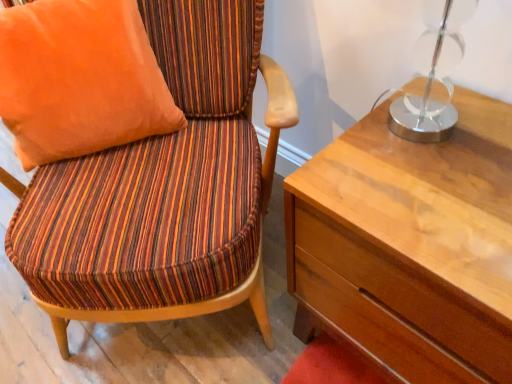
Question: Is striped fabric chair at left bigger than orange fabric pillow at upper left?

Choices:
 (A) yes
 (B) no

Answer: (A)

Question: From a real-world perspective, is striped fabric chair at left below orange fabric pillow at upper left?

Choices:
 (A) yes
 (B) no

Answer: (A)

Question: From a real-world perspective, is striped fabric chair at left on top of orange fabric pillow at upper left?

Choices:
 (A) no
 (B) yes

Answer: (A)

Question: Is striped fabric chair at left turned away from orange fabric pillow at upper left?

Choices:
 (A) no
 (B) yes

Answer: (B)

Question: From the image's perspective, is striped fabric chair at left beneath orange fabric pillow at upper left?

Choices:
 (A) no
 (B) yes

Answer: (B)

Question: From the image's perspective, would you say striped fabric chair at left is positioned over orange fabric pillow at upper left?

Choices:
 (A) no
 (B) yes

Answer: (A)

Question: Is orange fabric pillow at upper left far from striped fabric chair at left?

Choices:
 (A) no
 (B) yes

Answer: (A)

Question: Considering the relative sizes of orange fabric pillow at upper left and striped fabric chair at left in the image provided, is orange fabric pillow at upper left wider than striped fabric chair at left?

Choices:
 (A) yes
 (B) no

Answer: (B)

Question: Is orange fabric pillow at upper left further to camera compared to striped fabric chair at left?

Choices:
 (A) yes
 (B) no

Answer: (A)

Question: Considering the relative sizes of orange fabric pillow at upper left and striped fabric chair at left in the image provided, is orange fabric pillow at upper left thinner than striped fabric chair at left?

Choices:
 (A) yes
 (B) no

Answer: (A)

Question: Is orange fabric pillow at upper left smaller than striped fabric chair at left?

Choices:
 (A) yes
 (B) no

Answer: (A)

Question: From the image's perspective, would you say orange fabric pillow at upper left is shown under striped fabric chair at left?

Choices:
 (A) yes
 (B) no

Answer: (B)

Question: In terms of height, does orange fabric pillow at upper left look taller or shorter compared to striped fabric chair at left?

Choices:
 (A) short
 (B) tall

Answer: (A)